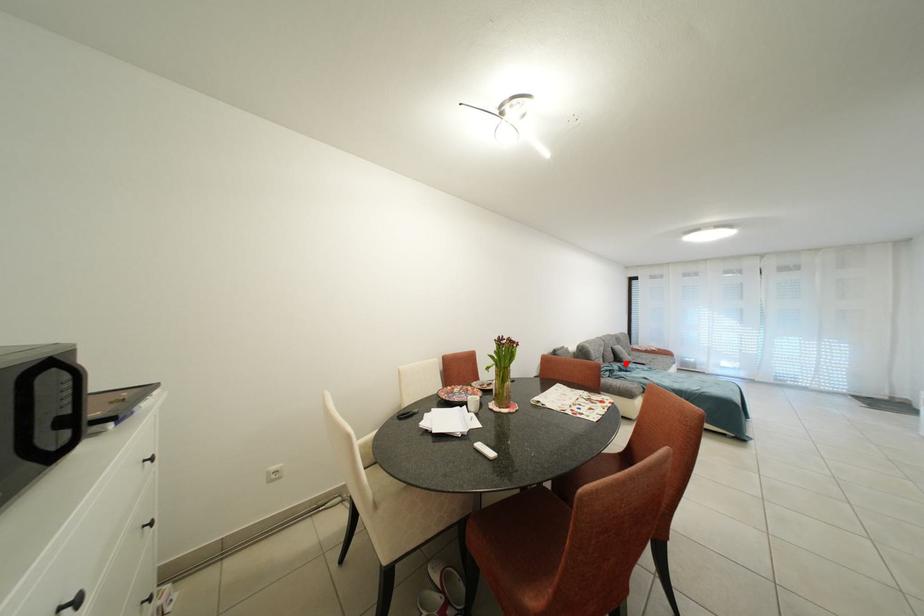
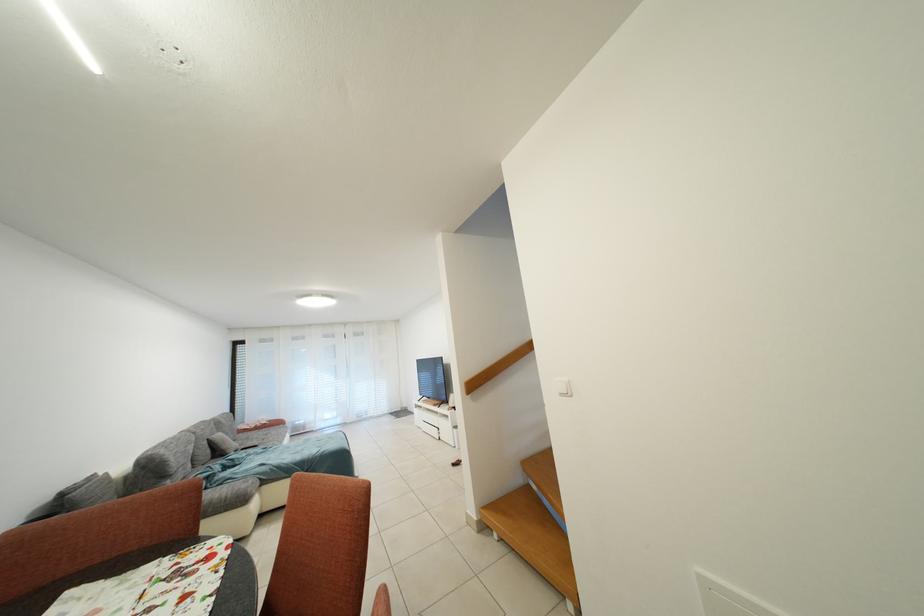
Find the pixel in the second image that matches the highlighted location in the first image.

(226, 456)